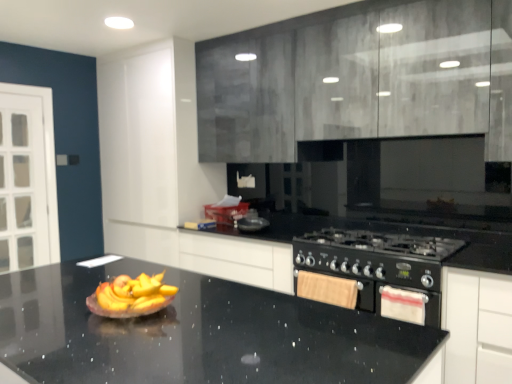
Find the location of `matte gray cabinets at upper center`. matte gray cabinets at upper center is located at coordinates 358,79.

What do you see at coordinates (409, 305) in the screenshot? I see `white fabric oven at lower right` at bounding box center [409, 305].

This screenshot has height=384, width=512. Describe the element at coordinates (378, 263) in the screenshot. I see `black matte gas stove at lower right` at that location.

Where is `matte gray cabinets at upper center`? matte gray cabinets at upper center is located at coordinates (358, 79).

Does black granite countertop at center have a greater height compared to matte gray cabinets at upper center?

Incorrect, the height of black granite countertop at center is not larger of that of matte gray cabinets at upper center.

Who is more distant, black granite countertop at center or matte gray cabinets at upper center?

matte gray cabinets at upper center is more distant.

Can you confirm if black granite countertop at center is smaller than matte gray cabinets at upper center?

Actually, black granite countertop at center might be larger than matte gray cabinets at upper center.

Is black granite countertop at center completely or partially outside of matte gray cabinets at upper center?

Yes, black granite countertop at center is located beyond the bounds of matte gray cabinets at upper center.

Is white fabric oven at lower right outside of matte gray cabinets at upper center?

That's correct, white fabric oven at lower right is outside of matte gray cabinets at upper center.

Is white fabric oven at lower right turned away from matte gray cabinets at upper center?

A: No, white fabric oven at lower right's orientation is not away from matte gray cabinets at upper center.

In the scene shown: Which is closer to the camera, (379, 290) or (461, 28)?

Point (379, 290) is positioned farther from the camera compared to point (461, 28).

Looking at this image, considering the sizes of objects matte gray cabinets at upper center and black matte gas stove at lower right in the image provided, who is wider, matte gray cabinets at upper center or black matte gas stove at lower right?

Wider between the two is black matte gas stove at lower right.

From a real-world perspective, is matte gray cabinets at upper center physically above black matte gas stove at lower right?

Yes.

Is matte gray cabinets at upper center to the left of black matte gas stove at lower right from the viewer's perspective?

Yes, matte gray cabinets at upper center is to the left of black matte gas stove at lower right.

Would you say black granite countertop at center is inside or outside white fabric oven at lower right?

black granite countertop at center cannot be found inside white fabric oven at lower right.

Is black granite countertop at center facing towards white fabric oven at lower right?

No, black granite countertop at center is not turned towards white fabric oven at lower right.

Find the location of a particular element. The height and width of the screenshot is (384, 512). oven above the black granite countertop at center (from the image's perspective) is located at coordinates tap(409, 305).

In the scene shown: Would you consider black granite countertop at center to be distant from white fabric oven at lower right?

black granite countertop at center is far away from white fabric oven at lower right.

From a real-world perspective, which object stands above the other?

From a 3D spatial view, matte gray cabinets at upper center is above.

Can you confirm if matte gray cabinets at upper center is positioned to the right of white fabric oven at lower right?

No.

From the image's perspective, which object appears higher, matte gray cabinets at upper center or white fabric oven at lower right?

→ matte gray cabinets at upper center, from the image's perspective.

Is white fabric oven at lower right behind black matte gas stove at lower right?

Yes.

From a real-world perspective, is white fabric oven at lower right located beneath black matte gas stove at lower right?

Correct, in the physical world, white fabric oven at lower right is lower than black matte gas stove at lower right.

Is white fabric oven at lower right not within black matte gas stove at lower right?

Absolutely, white fabric oven at lower right is external to black matte gas stove at lower right.

Locate an element on the screen. appliance behind the black granite countertop at center is located at coordinates (378, 263).

Considering the relative sizes of black matte gas stove at lower right and black granite countertop at center in the image provided, is black matte gas stove at lower right bigger than black granite countertop at center?

No, black matte gas stove at lower right is not bigger than black granite countertop at center.

Does black matte gas stove at lower right appear on the right side of black granite countertop at center?

Indeed, black matte gas stove at lower right is positioned on the right side of black granite countertop at center.

From a real-world perspective, is black matte gas stove at lower right positioned under black granite countertop at center based on gravity?

No.

What are the coordinates of `cabinetry above the black granite countertop at center (from a real-world perspective)` in the screenshot? It's located at (358, 79).

I want to click on cabinetry lying in front of the white fabric oven at lower right, so click(x=358, y=79).

Estimate the real-world distances between objects in this image. Which object is further from white fabric oven at lower right, matte gray cabinets at upper center or black granite countertop at center?

matte gray cabinets at upper center is further to white fabric oven at lower right.

Estimate the real-world distances between objects in this image. Which object is further from matte gray cabinets at upper center, white fabric oven at lower right or black matte gas stove at lower right?

The object further to matte gray cabinets at upper center is white fabric oven at lower right.

Which object lies nearer to the anchor point matte gray cabinets at upper center, black matte gas stove at lower right or black granite countertop at center?

Based on the image, black matte gas stove at lower right appears to be nearer to matte gray cabinets at upper center.

From the image, which object appears to be nearer to black granite countertop at center, black matte gas stove at lower right or matte gray cabinets at upper center?

Among the two, black matte gas stove at lower right is located nearer to black granite countertop at center.

From the image, which object appears to be farther from matte gray cabinets at upper center, black granite countertop at center or black matte gas stove at lower right?

black granite countertop at center is positioned further to the anchor matte gray cabinets at upper center.

Which object lies nearer to the anchor point black matte gas stove at lower right, white fabric oven at lower right or black granite countertop at center?

white fabric oven at lower right lies closer to black matte gas stove at lower right than the other object.

When comparing their distances from black matte gas stove at lower right, does matte gray cabinets at upper center or white fabric oven at lower right seem closer?

Among the two, white fabric oven at lower right is located nearer to black matte gas stove at lower right.

Consider the image. From the image, which object appears to be farther from black matte gas stove at lower right, matte gray cabinets at upper center or black granite countertop at center?

black granite countertop at center lies further to black matte gas stove at lower right than the other object.

Find the location of `appliance between matte gray cabinets at upper center and white fabric oven at lower right from top to bottom`. appliance between matte gray cabinets at upper center and white fabric oven at lower right from top to bottom is located at coordinates (378, 263).

I want to click on cabinetry between black granite countertop at center and black matte gas stove at lower right in the front-back direction, so click(358, 79).

You are a GUI agent. You are given a task and a screenshot of the screen. Output one action in this format:
    pyautogui.click(x=<x>, y=<y>)
    Task: Click on the cabinetry between black granite countertop at center and white fabric oven at lower right from front to back
    This screenshot has width=512, height=384.
    Given the screenshot: What is the action you would take?
    pyautogui.click(x=358, y=79)

The image size is (512, 384). Identify the location of appliance between black granite countertop at center and white fabric oven at lower right along the z-axis. (378, 263).